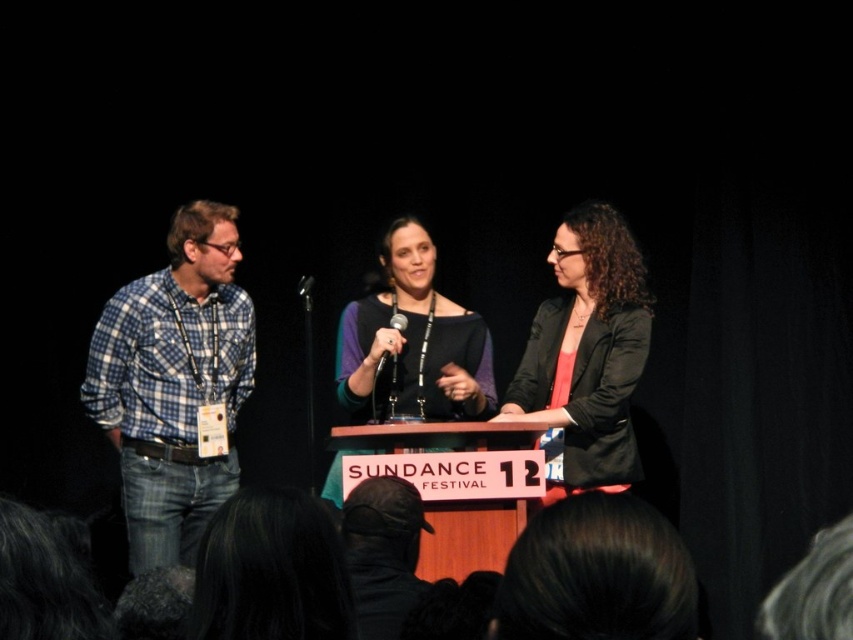
You are a photographer at the Sundance Festival event. You need to capture a photo where the blue plaid shirt at left and the metallic silver microphone at center are both visible. Which object should you adjust your camera angle to focus on first to ensure both are in frame?

The blue plaid shirt at left is wider than the metallic silver microphone at center, so you should focus on the blue plaid shirt at left first to ensure both objects fit within the camera frame.

You are an event photographer at the Sundance Festival. You need to capture a photo where the blue plaid shirt at left and the metallic silver microphone at center are both clearly visible. Based on their positions, will the microphone block the view of the blue plaid shirt?

The blue plaid shirt at left is below the metallic silver microphone at center, so the microphone will not block the view of the blue plaid shirt.

You are an event photographer at the Sundance Festival. You need to capture a clear shot of the matte black sweater at center and the black plastic microphone at center. Which object should you focus on first to ensure both are in focus?

The matte black sweater at center is closer to the viewer than the black plastic microphone at center. To ensure both are in focus, you should focus on the matte black sweater at center first, as it is the closer object, and then adjust the focus to include the farther microphone.